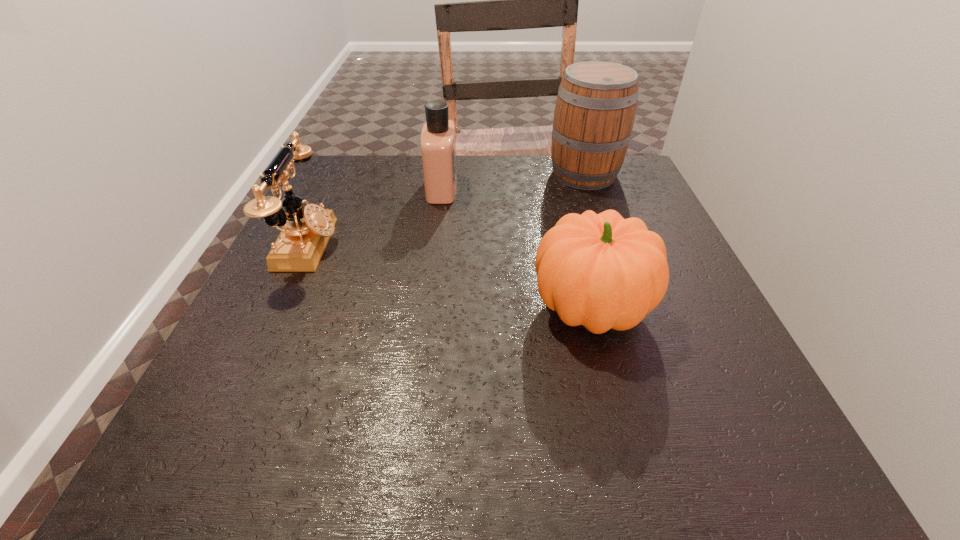
Image resolution: width=960 pixels, height=540 pixels. I want to click on object present at the left edge, so click(x=305, y=232).

Find the location of `cider that is at the right edge`. cider that is at the right edge is located at coordinates (595, 110).

This screenshot has height=540, width=960. What are the coordinates of `pumpkin that is at the right edge` in the screenshot? It's located at (602, 271).

Image resolution: width=960 pixels, height=540 pixels. Identify the location of object that is at the far right corner. (595, 110).

Find the location of a particular element. This screenshot has width=960, height=540. vacant area at the far edge of the desktop is located at coordinates (540, 167).

In the image, there is a desktop. Where is `vacant space at the near edge`? The width and height of the screenshot is (960, 540). vacant space at the near edge is located at coordinates (550, 436).

This screenshot has height=540, width=960. Identify the location of vacant region at the left edge. (308, 299).

At what (x,y) coordinates should I click in order to perform the action: click on vacant position at the right edge of the desktop. Please return your answer as a coordinate pair (x, y). Looking at the image, I should click on (634, 213).

In the image, there is a desktop. Where is `vacant space at the far left corner`? vacant space at the far left corner is located at coordinates (377, 183).

Find the location of a particular element. vacant space at the near left corner is located at coordinates (161, 484).